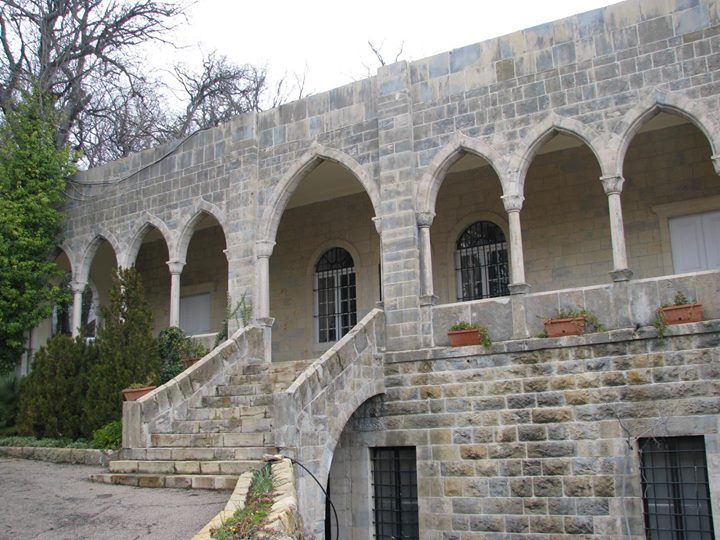
Locate an element on the screen. This screenshot has width=720, height=540. staircase is located at coordinates (268, 397).